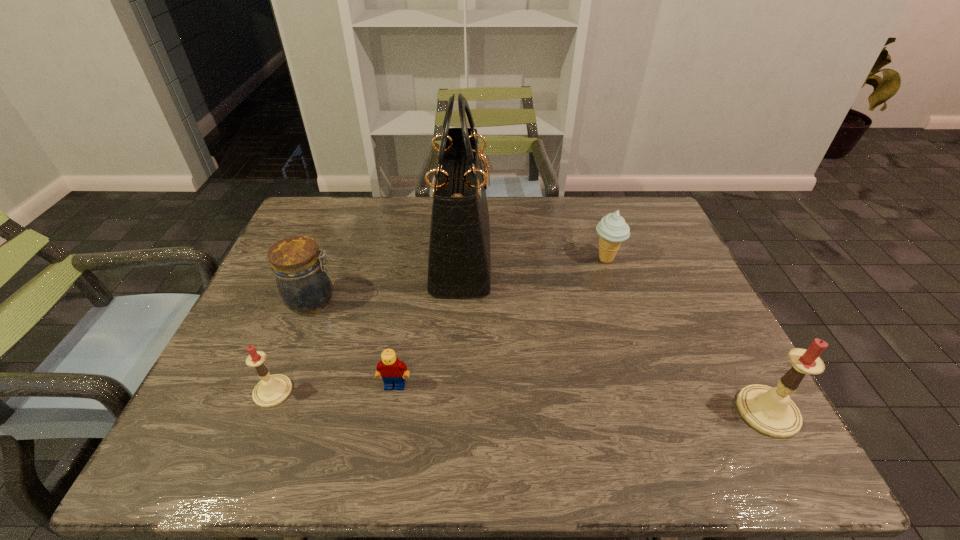
Find the location of a particular element. Image resolution: width=960 pixels, height=540 pixels. free space between the tallest object and the fifth shortest object is located at coordinates (614, 334).

This screenshot has height=540, width=960. I want to click on free point between the taller candle and the third object from left to right, so click(581, 399).

Identify the location of free space between the tallest object and the shorter candle. Image resolution: width=960 pixels, height=540 pixels. (367, 324).

Identify the location of vacant point located between the shorter candle and the shortest object. (334, 388).

Where is `vacant space that's between the third object from right to left and the fifth object from left to right`? The height and width of the screenshot is (540, 960). vacant space that's between the third object from right to left and the fifth object from left to right is located at coordinates (534, 258).

Locate an element on the screen. The image size is (960, 540). vacant area between the tallest object and the shortest object is located at coordinates (428, 321).

Locate an element on the screen. The image size is (960, 540). object that can be found as the fourth closest to the taller candle is located at coordinates (303, 282).

Point out which object is positioned as the fourth nearest to the fourth object from right to left. Please provide its 2D coordinates. Your answer should be formatted as a tuple, i.e. [(x, y)], where the tuple contains the x and y coordinates of a point satisfying the conditions above.

[(612, 229)]

Where is `free point that satisfies the following two spatial constraints: 1. on the back side of the taller candle; 2. at the front of the tallest object with visible charms`? The image size is (960, 540). free point that satisfies the following two spatial constraints: 1. on the back side of the taller candle; 2. at the front of the tallest object with visible charms is located at coordinates (684, 256).

Identify the location of free location that satisfies the following two spatial constraints: 1. on the front-facing side of the shortest object; 2. on the left side of the rightmost object. (391, 411).